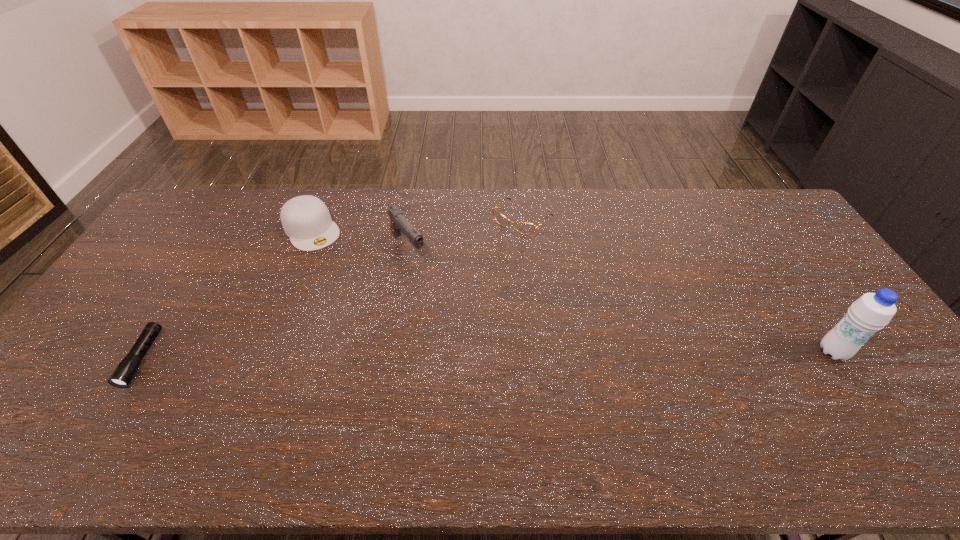
Find the location of `spectacles situated at the far edge`. spectacles situated at the far edge is located at coordinates (522, 227).

Locate an element on the screen. The image size is (960, 540). gun located at the far edge is located at coordinates (399, 223).

Identify the location of cap present at the far edge. The height and width of the screenshot is (540, 960). (306, 220).

Where is `object that is at the near edge`? This screenshot has width=960, height=540. object that is at the near edge is located at coordinates (125, 371).

You are a GUI agent. You are given a task and a screenshot of the screen. Output one action in this format:
    pyautogui.click(x=<x>, y=<y>)
    Task: Click on the object that is positioned at the right edge
    
    Given the screenshot: What is the action you would take?
    pyautogui.click(x=871, y=312)

Where is `vacant area at the far edge`? This screenshot has height=540, width=960. vacant area at the far edge is located at coordinates (671, 197).

Where is `blank space at the near edge of the desktop`? The width and height of the screenshot is (960, 540). blank space at the near edge of the desktop is located at coordinates (535, 408).

Where is `vacant space at the left edge`? Image resolution: width=960 pixels, height=540 pixels. vacant space at the left edge is located at coordinates tap(115, 314).

The image size is (960, 540). I want to click on vacant space at the right edge of the desktop, so click(x=815, y=316).

Find the location of a particular element. This screenshot has width=960, height=540. vacant space that is in between the fourth tallest object and the gun is located at coordinates (465, 233).